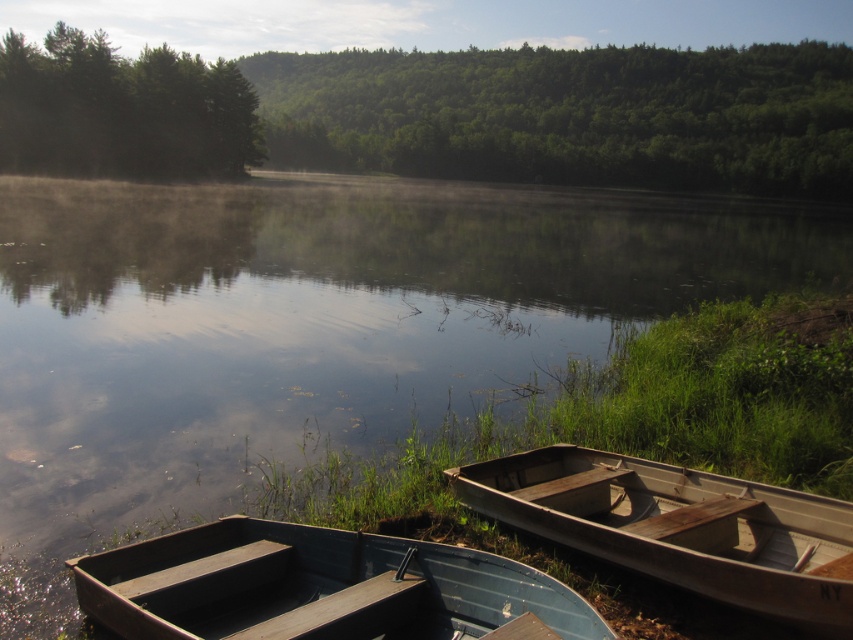
Question: Can you confirm if green leafy forest at upper center is wider than green matte trees at upper left?

Choices:
 (A) no
 (B) yes

Answer: (B)

Question: Among these points, which one is farthest from the camera?

Choices:
 (A) (204, 131)
 (B) (74, 412)

Answer: (A)

Question: Among these objects, which one is nearest to the camera?

Choices:
 (A) green leafy forest at upper center
 (B) wooden canoe at lower left

Answer: (B)

Question: Observing the image, what is the correct spatial positioning of green leafy forest at upper center in reference to wooden canoe at lower right?

Choices:
 (A) right
 (B) left

Answer: (A)

Question: Which object is farther from the camera taking this photo?

Choices:
 (A) green matte trees at upper left
 (B) green leafy forest at upper center
 (C) wooden canoe at lower left
 (D) wooden canoe at lower right

Answer: (B)

Question: Is clear water at lower left behind wooden canoe at lower right?

Choices:
 (A) yes
 (B) no

Answer: (A)